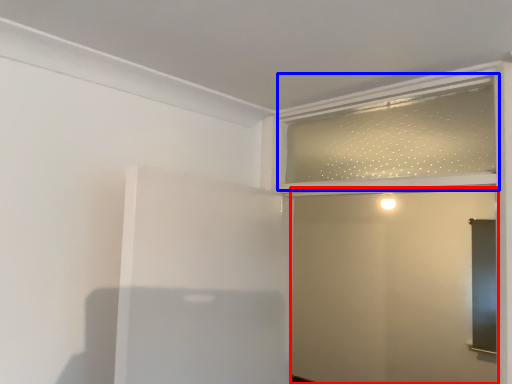
Question: Which object appears farthest to the camera in this image, screen door (highlighted by a red box) or window frame (highlighted by a blue box)?

Choices:
 (A) screen door
 (B) window frame

Answer: (B)